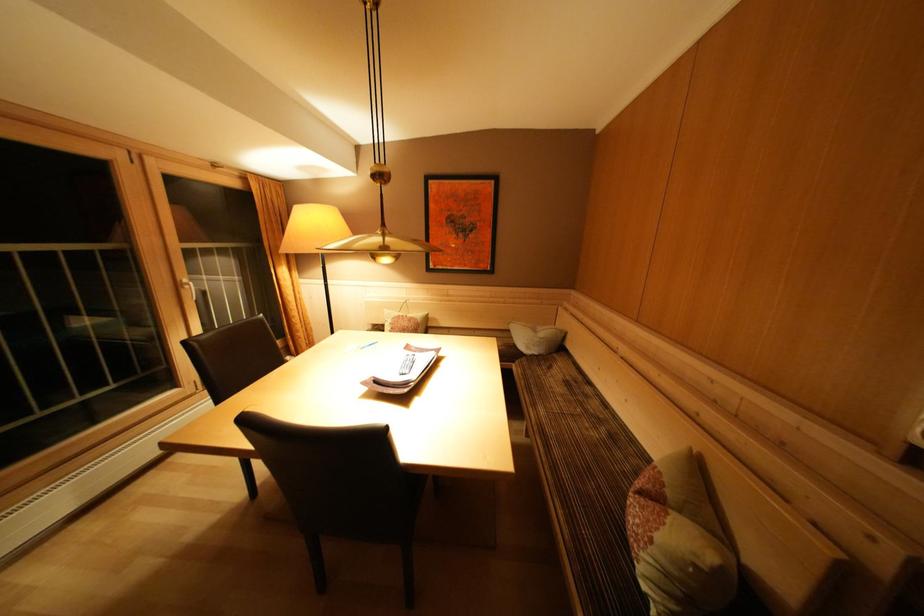
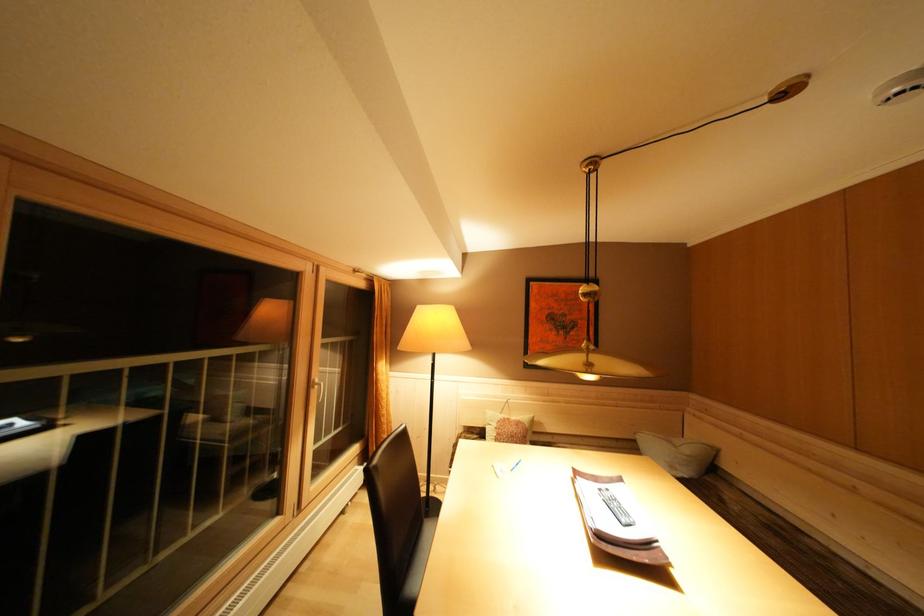
Where in the second image is the point corresponding to [549,339] from the first image?

(695, 456)